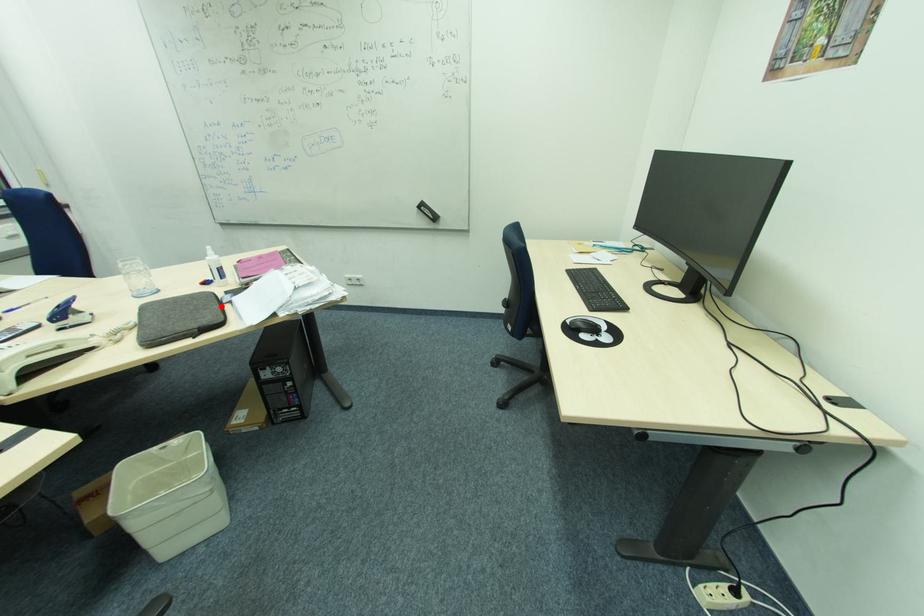
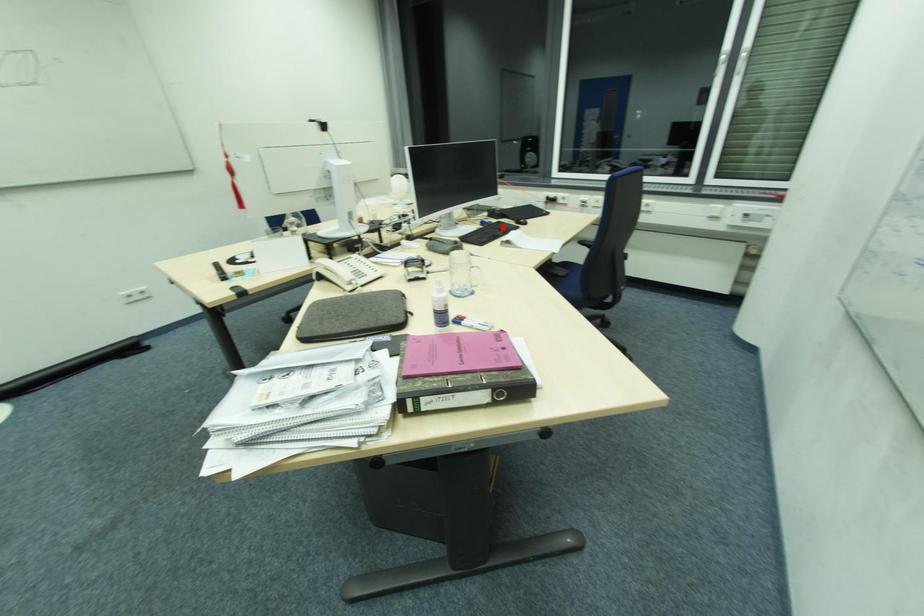
I am providing you with two images of the same scene from different viewpoints. A red point is marked on the first image and another point is marked on the second image. Is the marked point in image1 the same physical position as the marked point in image2?

No